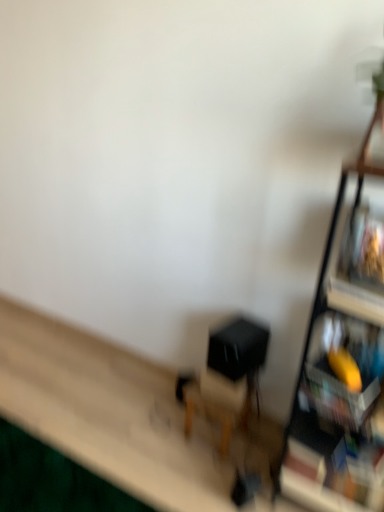
Locate an element on the screen. vacant area that is in front of matte black swivel chair at center is located at coordinates (228, 472).